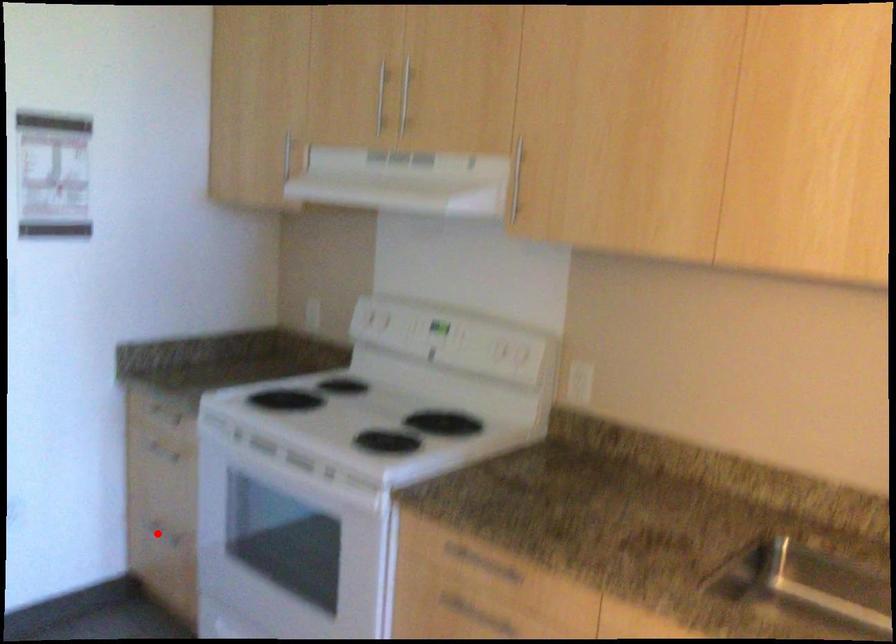
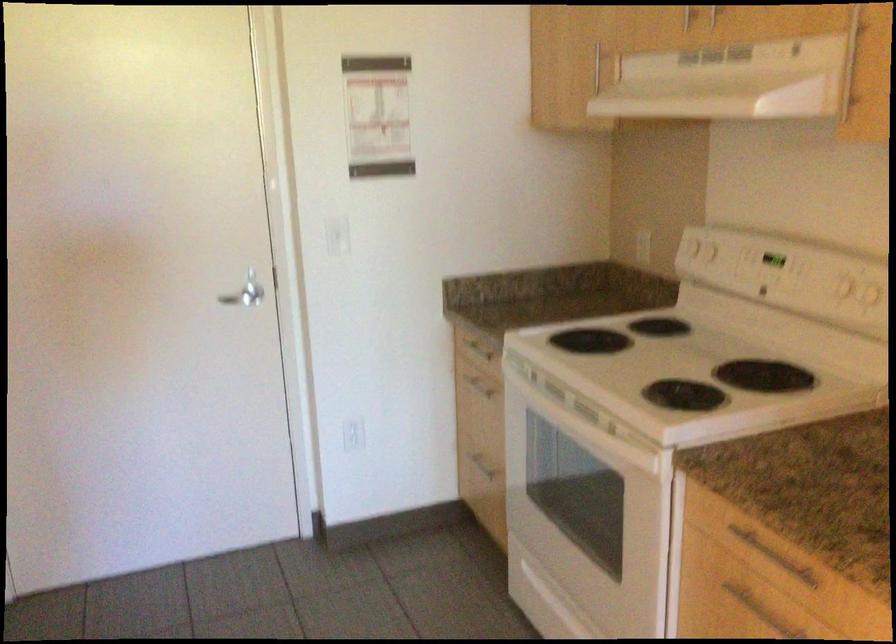
The point at the highlighted location is marked in the first image. Where is the corresponding point in the second image?

(478, 462)